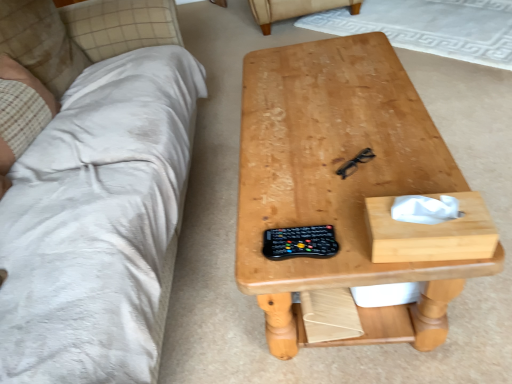
Question: Considering their positions, is black plastic remote at center located in front of or behind beige fabric armchair at upper center?

Choices:
 (A) front
 (B) behind

Answer: (A)

Question: Looking at the image, does black plastic remote at center seem bigger or smaller compared to beige fabric armchair at upper center?

Choices:
 (A) big
 (B) small

Answer: (B)

Question: Estimate the real-world distances between objects in this image. Which object is farther from the natural wood table at center?

Choices:
 (A) beige plaid fabric at left
 (B) white soft pillow at upper left
 (C) black plastic remote at center
 (D) beige fabric armchair at upper center

Answer: (D)

Question: Estimate the real-world distances between objects in this image. Which object is farther from the white soft pillow at upper left?

Choices:
 (A) beige fabric armchair at upper center
 (B) beige plaid fabric at left
 (C) black plastic remote at center
 (D) natural wood table at center

Answer: (A)